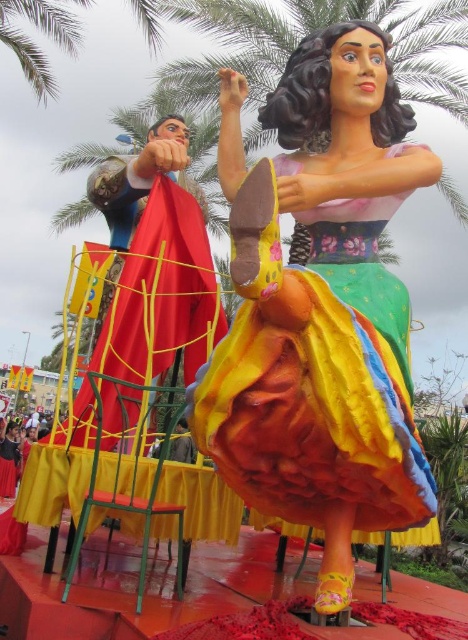
You are a parade attendee standing at the back of the float. You notice two points marked on the float. Which point, point [313,492] or point [146,531], is closer to you?

Point [146,531] is closer to you because it is behind point [313,492].

You are a photographer standing at the back of the float. You want to take a photo of the multicolored tulle skirt at center without the camera getting in the way. Is there enough space between them to do this?

The multicolored tulle skirt at center and camera are 1.80 meters apart from each other, so yes, there is enough space between them to take the photo without the camera obstructing the view.

You are standing in front of the float and want to locate the point at coordinates (x=327, y=374). Which object on the float corresponds to this point?

The point at coordinates (x=327, y=374) is located on the multicolored tulle skirt at center.